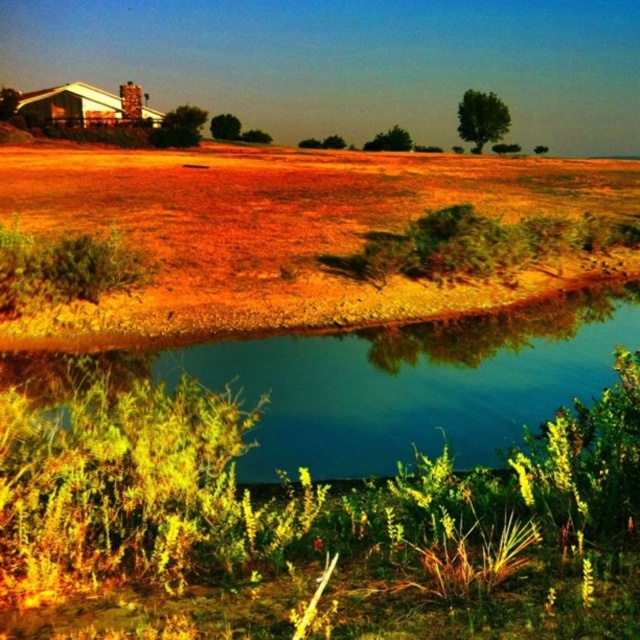
Question: Among these objects, which one is farthest from the camera?

Choices:
 (A) dried grass at center
 (B) green reflective water at center

Answer: (A)

Question: Which of the following is the closest to the observer?

Choices:
 (A) green reflective water at center
 (B) dried grass at center

Answer: (A)

Question: Is dried grass at center wider than green reflective water at center?

Choices:
 (A) yes
 (B) no

Answer: (A)

Question: Is dried grass at center above green reflective water at center?

Choices:
 (A) no
 (B) yes

Answer: (B)

Question: Observing the image, what is the correct spatial positioning of dried grass at center in reference to green reflective water at center?

Choices:
 (A) above
 (B) below

Answer: (A)